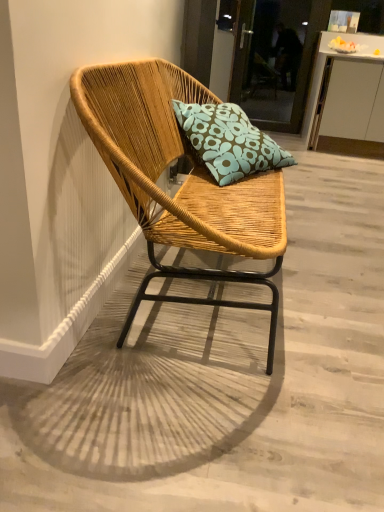
Question: Does transparent glass door at upper center contain natural wood chair at center?

Choices:
 (A) no
 (B) yes

Answer: (A)

Question: Is transparent glass door at upper center bigger than natural wood chair at center?

Choices:
 (A) yes
 (B) no

Answer: (B)

Question: From a real-world perspective, is transparent glass door at upper center located beneath natural wood chair at center?

Choices:
 (A) no
 (B) yes

Answer: (A)

Question: Is transparent glass door at upper center not close to natural wood chair at center?

Choices:
 (A) no
 (B) yes

Answer: (B)

Question: From the image's perspective, is transparent glass door at upper center located beneath natural wood chair at center?

Choices:
 (A) yes
 (B) no

Answer: (B)

Question: Considering the positions of transparent glass door at upper center and white glossy cabinet at upper right in the image, is transparent glass door at upper center taller or shorter than white glossy cabinet at upper right?

Choices:
 (A) tall
 (B) short

Answer: (A)

Question: In the image, is transparent glass door at upper center positioned in front of or behind white glossy cabinet at upper right?

Choices:
 (A) behind
 (B) front

Answer: (A)

Question: Is transparent glass door at upper center inside the boundaries of white glossy cabinet at upper right, or outside?

Choices:
 (A) inside
 (B) outside

Answer: (B)

Question: Is transparent glass door at upper center to the left or to the right of white glossy cabinet at upper right in the image?

Choices:
 (A) left
 (B) right

Answer: (A)

Question: Looking at the image, does natural wood chair at center seem bigger or smaller compared to transparent glass door at upper center?

Choices:
 (A) big
 (B) small

Answer: (A)

Question: In terms of width, does natural wood chair at center look wider or thinner when compared to transparent glass door at upper center?

Choices:
 (A) wide
 (B) thin

Answer: (A)

Question: From the image's perspective, relative to transparent glass door at upper center, is natural wood chair at center above or below?

Choices:
 (A) below
 (B) above

Answer: (A)

Question: Is natural wood chair at center taller or shorter than transparent glass door at upper center?

Choices:
 (A) tall
 (B) short

Answer: (B)

Question: Is transparent glass door at upper center situated inside teal floral cushion at center or outside?

Choices:
 (A) outside
 (B) inside

Answer: (A)

Question: Is transparent glass door at upper center to the left or to the right of teal floral cushion at center in the image?

Choices:
 (A) right
 (B) left

Answer: (A)